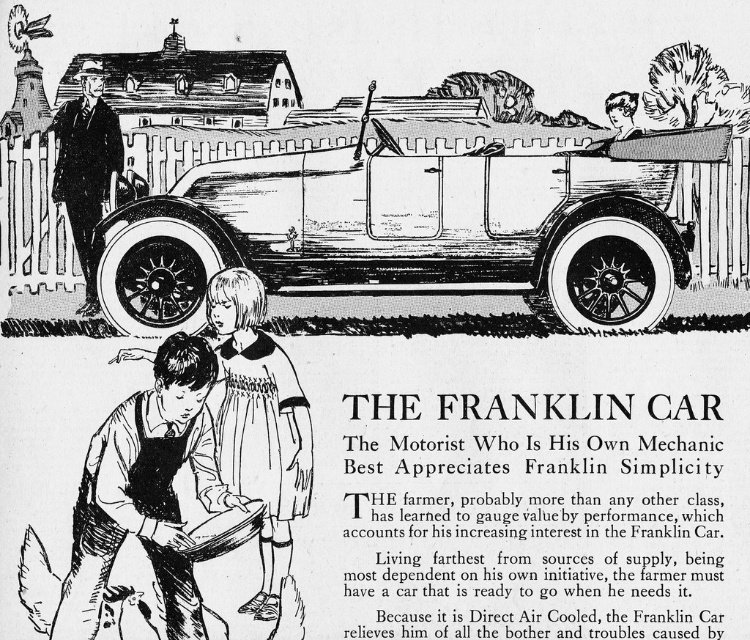
You are a delivery person trying to locate the address for The Franklin Car advertisement. The coordinates provided are point A at [252,328] and point B at [93,99]. According to the scene, which point is closer to the car?

Point A at [252,328] is in front of point B at [93,99], so it is closer to the car.

You are a tailor examining a vintage advertisement and notice two items of clothing on the man in the image. The items are the dark brown leather vest at lower left and the smooth black suit at left. Which clothing item takes up more space in the image?

The dark brown leather vest at lower left takes up more space in the image as it is bigger than the smooth black suit at left according to the description.

You are a graphic designer working on a digital restoration of this vintage car advertisement. You need to place a new text overlay for the car model name. The text must be positioned above the dark brown leather vest at lower left. Where should you place the text overlay in terms of coordinates?

The text overlay should be placed above the dark brown leather vest at lower left, which is located at coordinates point (147, 492). Therefore, the text should be positioned at a point slightly higher on the y coordinate, such as (112, 492).